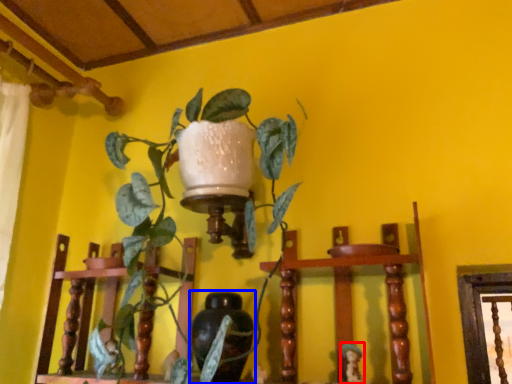
Question: Which object appears closest to the camera in this image, toy (highlighted by a red box) or vase (highlighted by a blue box)?

Choices:
 (A) toy
 (B) vase

Answer: (A)